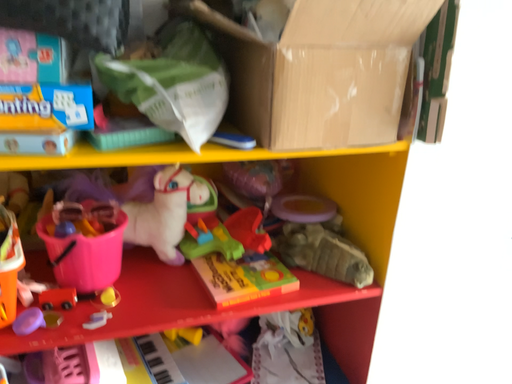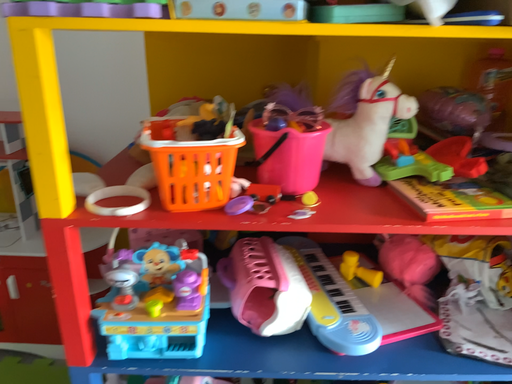
Question: Which way did the camera rotate in the video?

Choices:
 (A) rotated left
 (B) rotated right

Answer: (A)